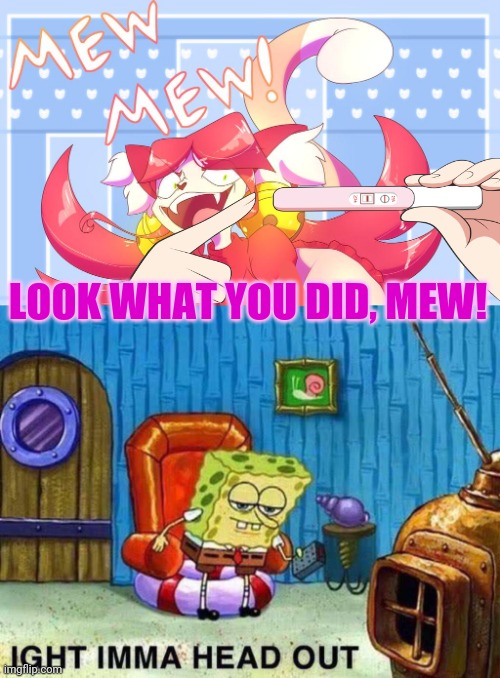
Identify the location of window. (41, 434).